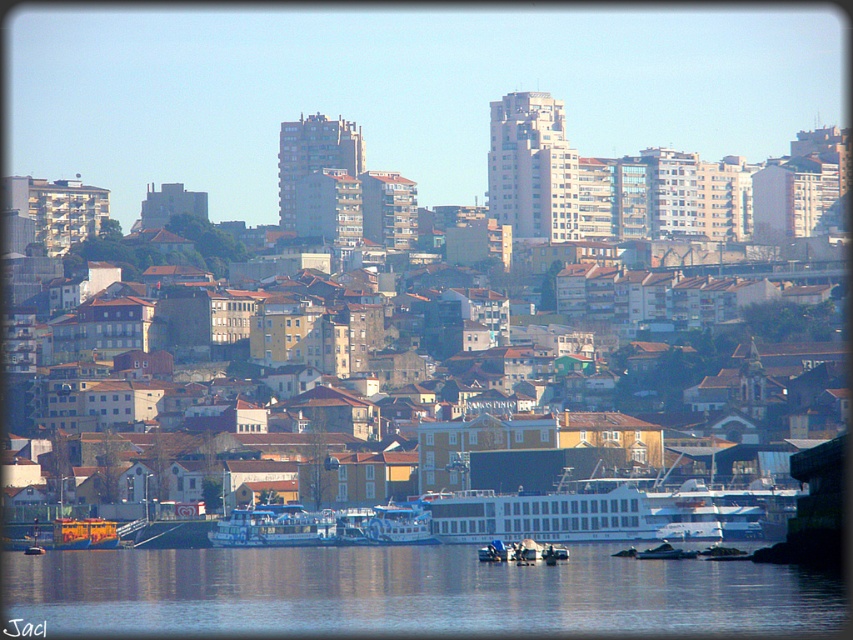
Question: Among these objects, which one is nearest to the camera?

Choices:
 (A) blue plastic boat at center
 (B) blue glossy ferry at center
 (C) transparent water at lower center

Answer: (C)

Question: Which point is closer to the camera?

Choices:
 (A) blue glossy ferry at center
 (B) transparent water at lower center

Answer: (B)

Question: Can you confirm if blue glossy ferry at center is positioned above blue plastic boat at center?

Choices:
 (A) no
 (B) yes

Answer: (A)

Question: In this image, where is transparent water at lower center located relative to blue plastic boat at center?

Choices:
 (A) left
 (B) right

Answer: (B)

Question: Which of the following is the closest to the observer?

Choices:
 (A) blue plastic boat at center
 (B) transparent water at lower center
 (C) blue glossy ferry at center

Answer: (B)

Question: Is blue glossy ferry at center in front of blue plastic boat at center?

Choices:
 (A) no
 (B) yes

Answer: (A)